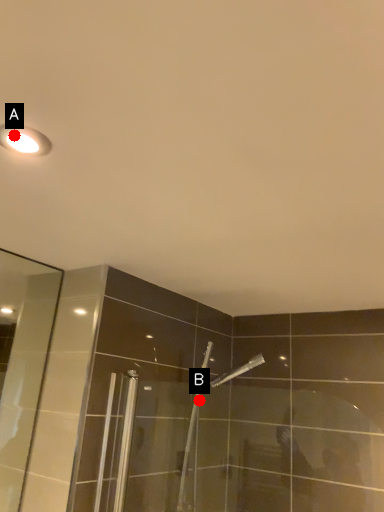
Question: Two points are circled on the image, labeled by A and B beside each circle. Among these points, which one is farthest from the camera?

Choices:
 (A) A is further
 (B) B is further

Answer: (B)